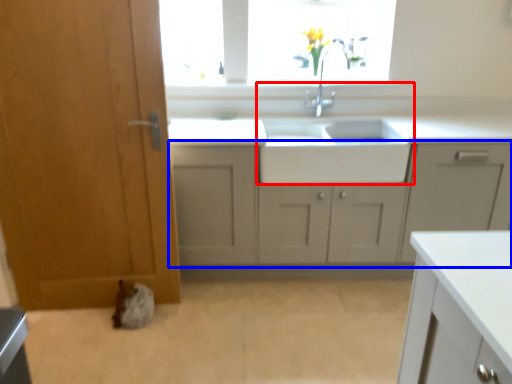
Question: Which object is closer to the camera taking this photo, sink (highlighted by a red box) or cabinetry (highlighted by a blue box)?

Choices:
 (A) sink
 (B) cabinetry

Answer: (B)